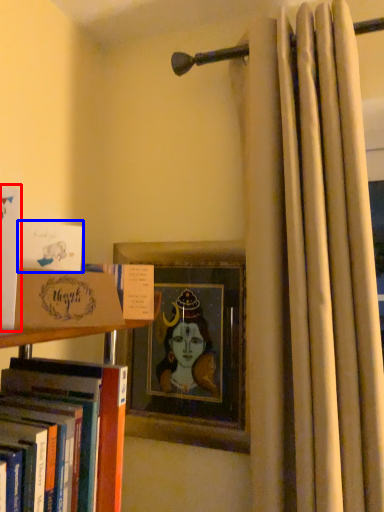
Question: Which of the following is the farthest to the observer, book (highlighted by a red box) or book (highlighted by a blue box)?

Choices:
 (A) book
 (B) book

Answer: (B)